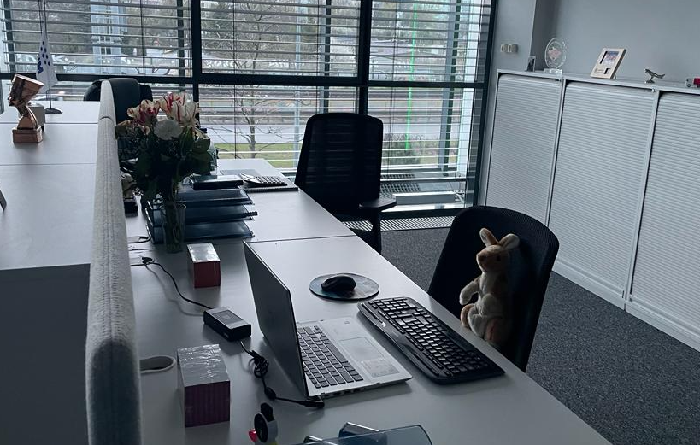
I want to click on 2 black chairs, so click(449, 240), click(302, 148).